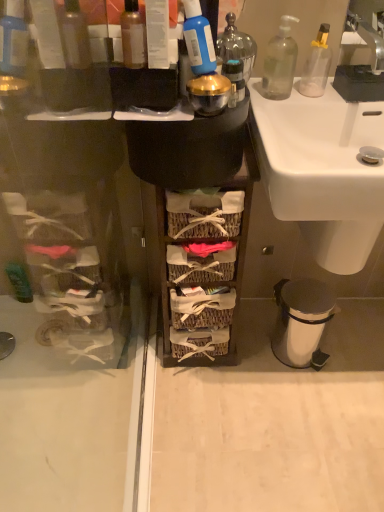
The image size is (384, 512). In order to click on green matte bottle at left, positioned as the second toiletry in top-to-bottom order in this screenshot , I will do `click(19, 281)`.

What do you see at coordinates (322, 170) in the screenshot? The height and width of the screenshot is (512, 384). I see `white ceramic sink at center` at bounding box center [322, 170].

From the picture: What is the approximate height of transparent glass soap dispenser at upper right, arranged as the first bottle when viewed from the right?

7.24 inches.

What is the approximate height of white plastic trash can at lower right?

10.45 inches.

Locate an element on the screen. metallic gold bowl at upper center, which is the second toiletry in left-to-right order is located at coordinates (234, 80).

Where is `green matte bottle at left, placed as the second toiletry when sorted from right to left`? This screenshot has height=512, width=384. green matte bottle at left, placed as the second toiletry when sorted from right to left is located at coordinates (19, 281).

Is woven wood basket at center, arranged as the 2th cabinetry when viewed from the left, positioned in front of translucent plastic bottle at upper center, which is counted as the 1th bottle, starting from the front?

No, it is not.

From a real-world perspective, is woven wood basket at center, placed as the first cabinetry when sorted from right to left, physically located above or below translucent plastic bottle at upper center, positioned as the 3th bottle in back-to-front order?

woven wood basket at center, placed as the first cabinetry when sorted from right to left, is below translucent plastic bottle at upper center, positioned as the 3th bottle in back-to-front order.

Based on the photo, is woven wood basket at center, arranged as the 2th cabinetry when viewed from the left, positioned with its back to translucent plastic bottle at upper center, positioned as the 3th bottle in back-to-front order?

No, woven wood basket at center, arranged as the 2th cabinetry when viewed from the left, is not facing the opposite direction of translucent plastic bottle at upper center, positioned as the 3th bottle in back-to-front order.

Is woven wood basket at center, arranged as the 2th cabinetry when viewed from the left, to the right of translucent plastic bottle at upper center, which ranks as the 3th bottle in right-to-left order, from the viewer's perspective?

Yes, woven wood basket at center, arranged as the 2th cabinetry when viewed from the left, is to the right of translucent plastic bottle at upper center, which ranks as the 3th bottle in right-to-left order.

Is blue plastic bottle at upper center in front of or behind green matte bottle at left, positioned as the second toiletry in top-to-bottom order, in the image?

blue plastic bottle at upper center is in front of green matte bottle at left, positioned as the second toiletry in top-to-bottom order.

Is point (183, 31) farther from camera compared to point (29, 294)?

No, it is not.

From a real-world perspective, which is physically above, blue plastic bottle at upper center or green matte bottle at left, positioned as the second toiletry in top-to-bottom order?

blue plastic bottle at upper center is physically above.

Is blue plastic bottle at upper center facing towards green matte bottle at left, which ranks as the 2th toiletry in front-to-back order?

No.

Is matte black cabinet at left, which ranks as the 1th cabinetry in left-to-right order, wider than white plastic trash can at lower right?

No.

Is matte black cabinet at left, which is the 2th cabinetry from right to left, not inside white plastic trash can at lower right?

Yes, matte black cabinet at left, which is the 2th cabinetry from right to left, is outside of white plastic trash can at lower right.

From the image's perspective, is matte black cabinet at left, which is the 2th cabinetry from right to left, below white plastic trash can at lower right?

No, from the image's perspective, matte black cabinet at left, which is the 2th cabinetry from right to left, is not below white plastic trash can at lower right.

Can you confirm if matte black cabinet at left, which ranks as the 1th cabinetry in left-to-right order, is positioned to the left of white plastic trash can at lower right?

Answer: Correct, you'll find matte black cabinet at left, which ranks as the 1th cabinetry in left-to-right order, to the left of white plastic trash can at lower right.

Is translucent plastic bottle at upper center, positioned as the 3th bottle in back-to-front order, located outside woven wood basket at center, arranged as the 2th cabinetry when viewed from the left?

Indeed, translucent plastic bottle at upper center, positioned as the 3th bottle in back-to-front order, is completely outside woven wood basket at center, arranged as the 2th cabinetry when viewed from the left.

From the image's perspective, would you say translucent plastic bottle at upper center, which is counted as the 1th bottle, starting from the front, is shown under woven wood basket at center, placed as the first cabinetry when sorted from right to left?

No, from the image's perspective, translucent plastic bottle at upper center, which is counted as the 1th bottle, starting from the front, is not beneath woven wood basket at center, placed as the first cabinetry when sorted from right to left.

From a real-world perspective, count 3rd bottles upward from the woven wood basket at center, arranged as the 2th cabinetry when viewed from the left, and point to it. Please provide its 2D coordinates.

[(133, 36)]

Does translucent plastic bottle at upper center, which ranks as the 3th bottle in right-to-left order, appear on the right side of woven wood basket at center, placed as the first cabinetry when sorted from right to left?

In fact, translucent plastic bottle at upper center, which ranks as the 3th bottle in right-to-left order, is to the left of woven wood basket at center, placed as the first cabinetry when sorted from right to left.

Is matte black cabinet at left, which ranks as the 1th cabinetry in left-to-right order, inside silver metallic faucet at upper right?

Definitely not — matte black cabinet at left, which ranks as the 1th cabinetry in left-to-right order, is not inside silver metallic faucet at upper right.

From a real-world perspective, is silver metallic faucet at upper right physically located above or below matte black cabinet at left, which is the 2th cabinetry from right to left?

silver metallic faucet at upper right is above matte black cabinet at left, which is the 2th cabinetry from right to left.

What's the angular difference between silver metallic faucet at upper right and matte black cabinet at left, which is the 2th cabinetry from right to left,'s facing directions?

The facing directions of silver metallic faucet at upper right and matte black cabinet at left, which is the 2th cabinetry from right to left, are 1.47 degrees apart.

From a real-world perspective, who is located higher, translucent glass bottle at upper center, acting as the 2th bottle starting from the back, or metallic gold bowl at upper center, placed as the second toiletry when sorted from bottom to top?

From a 3D spatial view, translucent glass bottle at upper center, acting as the 2th bottle starting from the back, is above.

Is translucent glass bottle at upper center, the 2th bottle in the left-to-right sequence, positioned with its back to metallic gold bowl at upper center, the 1th toiletry viewed from the right?

translucent glass bottle at upper center, the 2th bottle in the left-to-right sequence, does not have its back to metallic gold bowl at upper center, the 1th toiletry viewed from the right.

Is translucent glass bottle at upper center, which appears as the 2th bottle when viewed from the right, at the right side of metallic gold bowl at upper center, which is the second toiletry in left-to-right order?

Incorrect, translucent glass bottle at upper center, which appears as the 2th bottle when viewed from the right, is not on the right side of metallic gold bowl at upper center, which is the second toiletry in left-to-right order.

Would you say metallic gold bowl at upper center, the 1th toiletry viewed from the right, is part of translucent glass bottle at upper center, acting as the 2th bottle starting from the back,'s contents?

No, metallic gold bowl at upper center, the 1th toiletry viewed from the right, is not surrounded by translucent glass bottle at upper center, acting as the 2th bottle starting from the back.

How different are the orientations of metallic gold bowl at upper center, which is the first toiletry in front-to-back order, and blue plastic bottle at upper center in degrees?

metallic gold bowl at upper center, which is the first toiletry in front-to-back order, and blue plastic bottle at upper center are facing 0.0019 degrees away from each other.

Where is `toiletry to the right of blue plastic bottle at upper center`? This screenshot has width=384, height=512. toiletry to the right of blue plastic bottle at upper center is located at coordinates (234, 80).

Considering the relative sizes of metallic gold bowl at upper center, positioned as the first toiletry in top-to-bottom order, and blue plastic bottle at upper center in the image provided, is metallic gold bowl at upper center, positioned as the first toiletry in top-to-bottom order, thinner than blue plastic bottle at upper center?

Yes.

From a real-world perspective, is metallic gold bowl at upper center, the 1th toiletry viewed from the right, physically located above or below blue plastic bottle at upper center?

From a real-world perspective, metallic gold bowl at upper center, the 1th toiletry viewed from the right, is physically below blue plastic bottle at upper center.

Locate an element on the screen. This screenshot has height=512, width=384. cabinetry that is the 1st one when counting backward from the translucent plastic bottle at upper center, which is counted as the 1th bottle, starting from the front is located at coordinates (237, 248).

From a real-world perspective, count 2nd toiletrys downward from the blue plastic bottle at upper center and point to it. Please provide its 2D coordinates.

[(19, 281)]

From the picture: Considering their positions, is transparent glass soap dispenser at upper right, which is the first bottle from back to front, positioned further to silver metallic faucet at upper right than woven wood basket at center, arranged as the 2th cabinetry when viewed from the left?

woven wood basket at center, arranged as the 2th cabinetry when viewed from the left.

From the picture: From the image, which object appears to be farther from blue plastic bottle at upper center, woven wood basket at center, arranged as the 2th cabinetry when viewed from the left, or white plastic trash can at lower right?

Based on the image, white plastic trash can at lower right appears to be further to blue plastic bottle at upper center.

From the image, which object appears to be nearer to translucent glass bottle at upper center, acting as the 2th bottle starting from the back, green matte bottle at left, which ranks as the 2th toiletry in front-to-back order, or translucent plastic bottle at upper center, positioned as the 3th bottle in back-to-front order?

Based on the image, translucent plastic bottle at upper center, positioned as the 3th bottle in back-to-front order, appears to be nearer to translucent glass bottle at upper center, acting as the 2th bottle starting from the back.

Considering their positions, is silver metallic faucet at upper right positioned further to matte black cabinet at left, which is the 2th cabinetry from right to left, than green matte bottle at left, the 1th toiletry when ordered from back to front?

The object further to matte black cabinet at left, which is the 2th cabinetry from right to left, is silver metallic faucet at upper right.

Looking at the image, which one is located closer to silver metallic faucet at upper right, blue plastic bottle at upper center or matte black cabinet at left, which ranks as the 1th cabinetry in left-to-right order?

blue plastic bottle at upper center.

From the image, which object appears to be farther from green matte bottle at left, positioned as the second toiletry in top-to-bottom order, metallic gold bowl at upper center, placed as the second toiletry when sorted from bottom to top, or white ceramic sink at center?

Based on the image, metallic gold bowl at upper center, placed as the second toiletry when sorted from bottom to top, appears to be further to green matte bottle at left, positioned as the second toiletry in top-to-bottom order.

From the image, which object appears to be nearer to blue plastic bottle at upper center, translucent glass bottle at upper center, which is the 2th bottle in front-to-back order, or transparent glass soap dispenser at upper right, which is the first bottle from back to front?

translucent glass bottle at upper center, which is the 2th bottle in front-to-back order.

Looking at the image, which one is located closer to blue plastic bottle at upper center, woven wood basket at center, placed as the first cabinetry when sorted from right to left, or metallic gold bowl at upper center, positioned as the first toiletry in top-to-bottom order?

metallic gold bowl at upper center, positioned as the first toiletry in top-to-bottom order, lies closer to blue plastic bottle at upper center than the other object.

You are a GUI agent. You are given a task and a screenshot of the screen. Output one action in this format:
    pyautogui.click(x=<x>, y=<y>)
    Task: Click on the sink between translucent glass bottle at upper center, acting as the 2th bottle starting from the back, and white plastic trash can at lower right from top to bottom
    
    Given the screenshot: What is the action you would take?
    pyautogui.click(x=322, y=170)

Where is `sink between metallic gold bowl at upper center, which is the first toiletry in front-to-back order, and white plastic trash can at lower right from top to bottom`? The image size is (384, 512). sink between metallic gold bowl at upper center, which is the first toiletry in front-to-back order, and white plastic trash can at lower right from top to bottom is located at coordinates (322, 170).

Identify the location of toiletry between matte black cabinet at left, which ranks as the 1th cabinetry in left-to-right order, and silver metallic faucet at upper right from left to right. The height and width of the screenshot is (512, 384). (234, 80).

Locate an element on the screen. This screenshot has height=512, width=384. sink between silver metallic faucet at upper right and white plastic trash can at lower right from top to bottom is located at coordinates (322, 170).